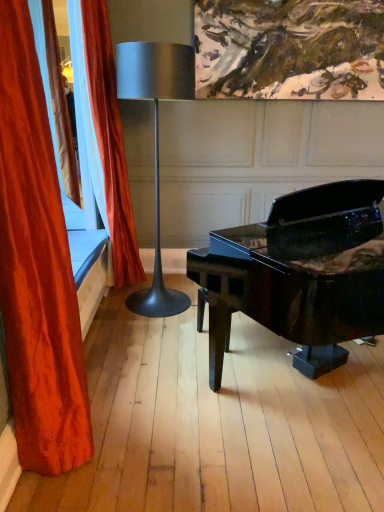
The image size is (384, 512). In order to click on vacant area that is in front of metallic silver lamp at center in this screenshot , I will do `click(143, 333)`.